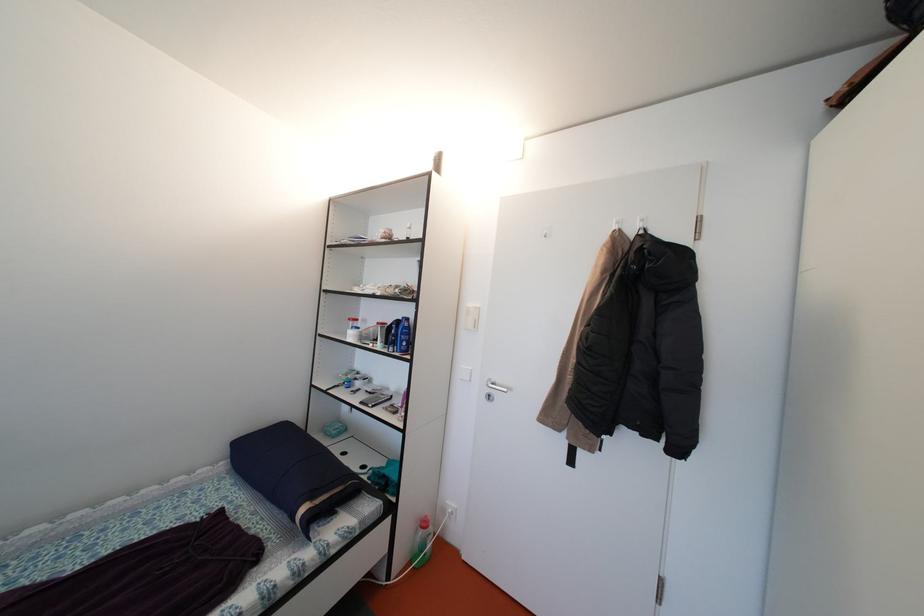
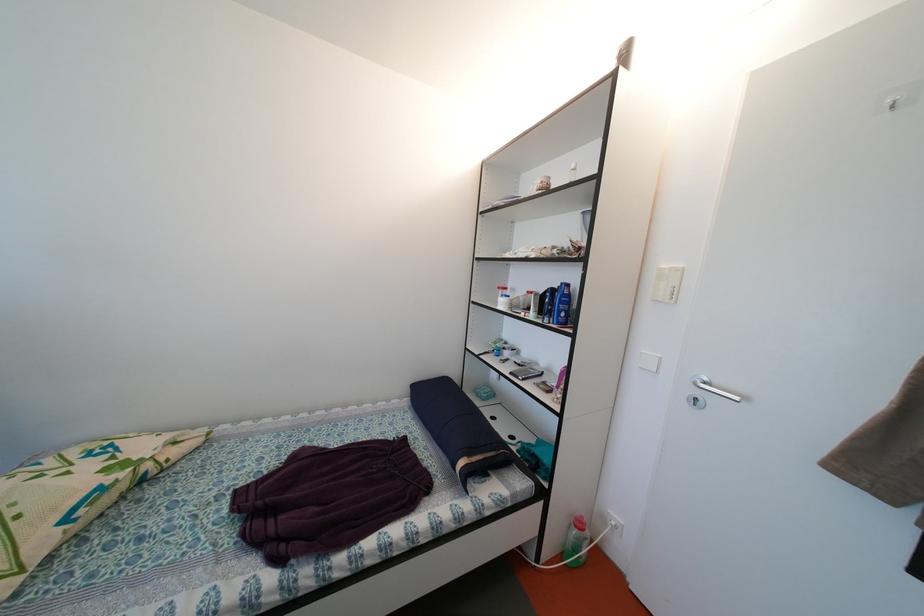
Where in the second image is the point corresponding to pixel 496 400 from the first image?

(703, 405)